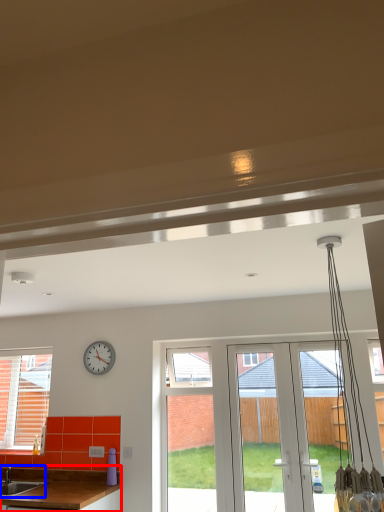
Question: Which point is further to the camera, countertop (highlighted by a red box) or sink (highlighted by a blue box)?

Choices:
 (A) countertop
 (B) sink

Answer: (B)